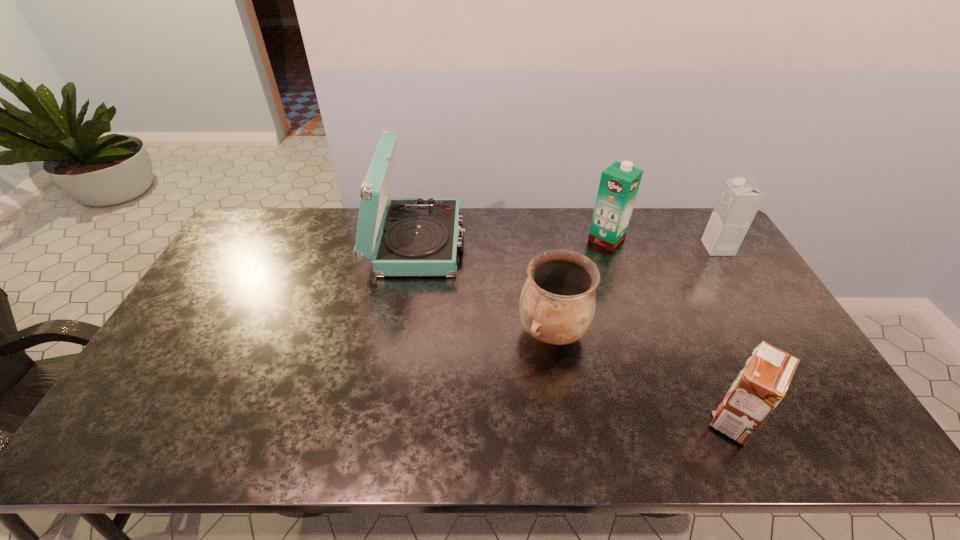
What are the coordinates of `vacant space at the far edge of the desktop` in the screenshot? It's located at (307, 223).

This screenshot has height=540, width=960. I want to click on free space at the near edge of the desktop, so coord(407,454).

You are a GUI agent. You are given a task and a screenshot of the screen. Output one action in this format:
    pyautogui.click(x=<x>, y=<y>)
    Task: Click on the free space at the left edge
    
    Given the screenshot: What is the action you would take?
    pyautogui.click(x=228, y=283)

Identify the location of vacant space at the right edge of the desktop. The image size is (960, 540). (733, 329).

Locate an element on the screen. vacant area at the far left corner is located at coordinates (289, 212).

I want to click on vacant space that's between the second object from left to right and the fourth object from left to right, so pos(643,375).

At what (x,y) coordinates should I click in order to perform the action: click on free point between the rightmost carton and the nearest object. Please return your answer as a coordinate pair (x, y). The height and width of the screenshot is (540, 960). Looking at the image, I should click on [x=726, y=333].

Where is `empty location between the leftmost object and the rightmost object`? empty location between the leftmost object and the rightmost object is located at coordinates (567, 246).

Locate an element on the screen. free space between the rightmost object and the leftmost object is located at coordinates (567, 246).

What are the coordinates of `empty space that is in between the leftmost object and the urn` in the screenshot? It's located at (485, 288).